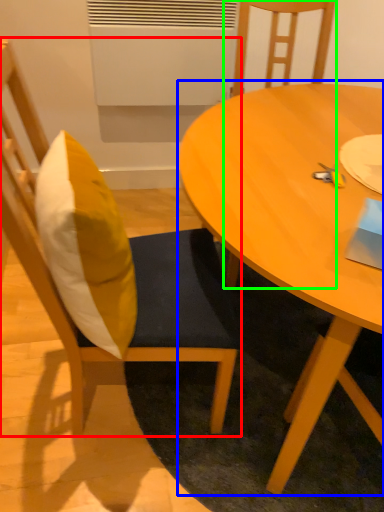
Question: Which object is positioned closest to chair (highlighted by a red box)? Select from coffee table (highlighted by a blue box) and chair (highlighted by a green box).

Choices:
 (A) coffee table
 (B) chair

Answer: (A)